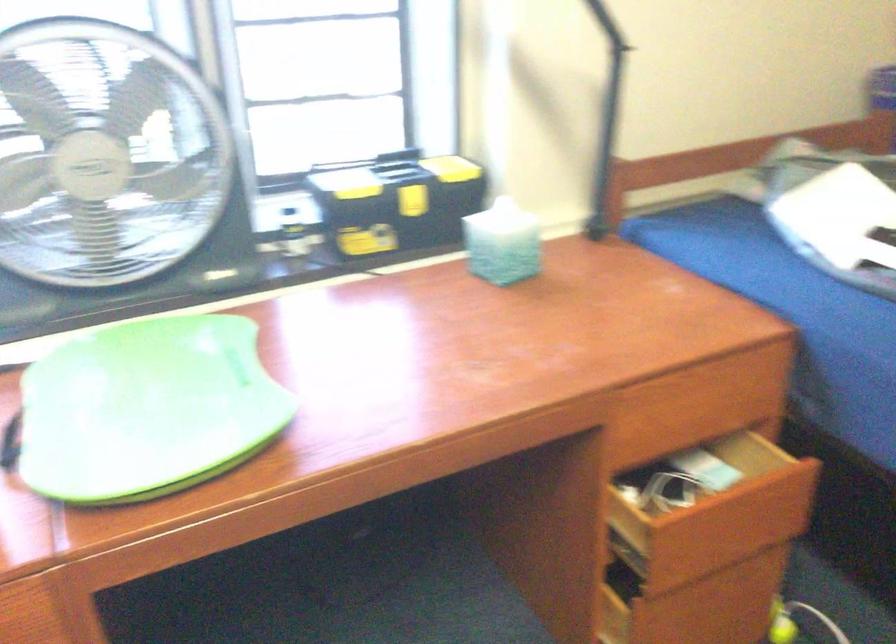
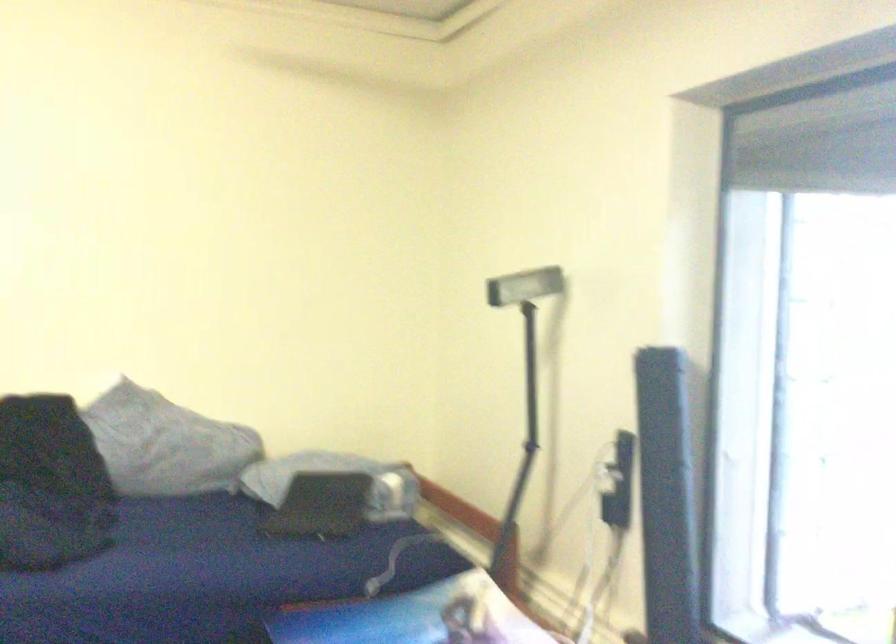
Question: The camera is either moving clockwise (left) or counter-clockwise (right) around the object. The first image is from the beginning of the video and the second image is from the end. Is the camera moving left or right when shooting the video?

Choices:
 (A) Left
 (B) Right

Answer: (B)